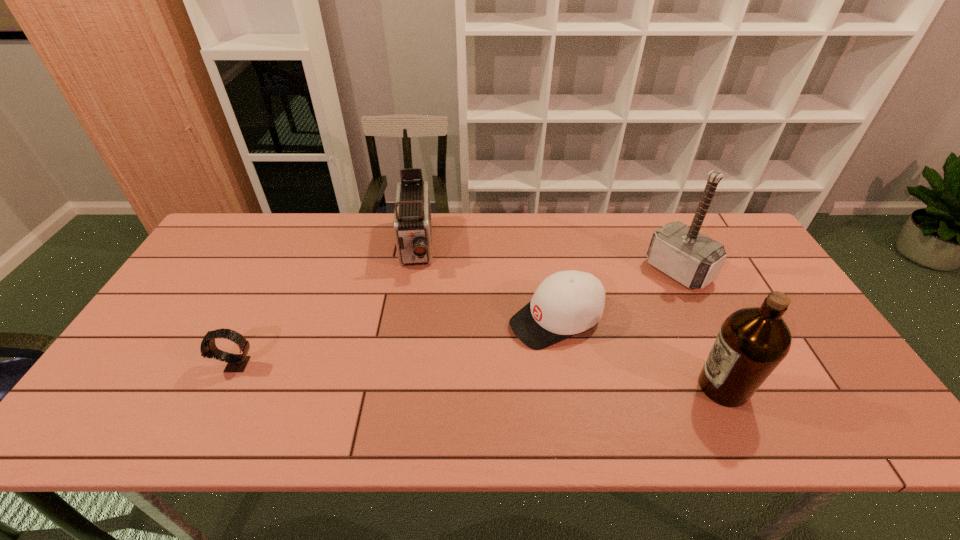
Identify the location of free space located on the front-facing side of the baseball cap. (489, 345).

Image resolution: width=960 pixels, height=540 pixels. Identify the location of camcorder situated at the far edge. (412, 224).

You are a GUI agent. You are given a task and a screenshot of the screen. Output one action in this format:
    pyautogui.click(x=<x>, y=<y>)
    Task: Click on the hammer positioned at the far edge
    The height and width of the screenshot is (540, 960).
    Given the screenshot: What is the action you would take?
    pyautogui.click(x=683, y=253)

Identify the location of watch situated at the near edge. This screenshot has width=960, height=540. (235, 362).

I want to click on olive oil located at the near edge, so click(x=753, y=341).

Where is `free space at the far edge of the desktop`? This screenshot has height=540, width=960. free space at the far edge of the desktop is located at coordinates (639, 239).

At what (x,y) coordinates should I click in order to perform the action: click on free region at the near edge. Please return your answer as a coordinate pair (x, y). Looking at the image, I should click on (252, 370).

The image size is (960, 540). In order to click on vacant region at the left edge in this screenshot , I will do `click(195, 340)`.

In the image, there is a desktop. Find the location of `free space at the right edge`. free space at the right edge is located at coordinates (734, 282).

You are a GUI agent. You are given a task and a screenshot of the screen. Output one action in this format:
    pyautogui.click(x=<x>, y=<y>)
    Task: Click on the vacant area at the far right corner
    The image size is (960, 540).
    Given the screenshot: What is the action you would take?
    pyautogui.click(x=748, y=240)